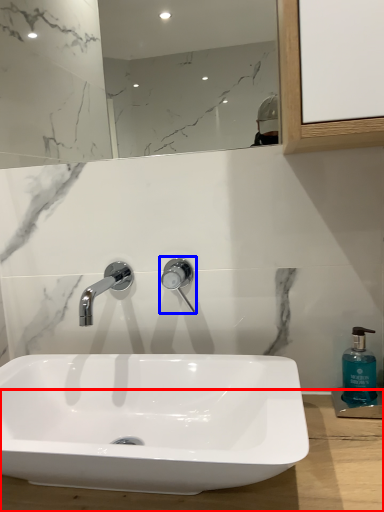
Question: Which of the following is the closest to the observer, counter top (highlighted by a red box) or tap (highlighted by a blue box)?

Choices:
 (A) counter top
 (B) tap

Answer: (A)